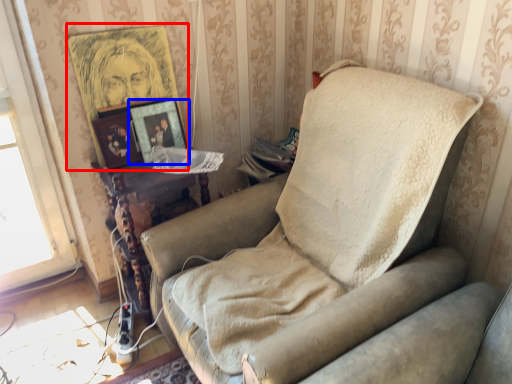
Question: Which object appears farthest to the camera in this image, picture frame (highlighted by a red box) or picture frame (highlighted by a blue box)?

Choices:
 (A) picture frame
 (B) picture frame

Answer: (B)